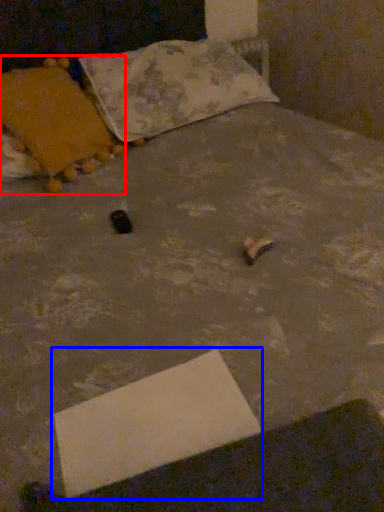
Question: Which point is closer to the camera, pillow (highlighted by a red box) or cardboard box (highlighted by a blue box)?

Choices:
 (A) pillow
 (B) cardboard box

Answer: (B)